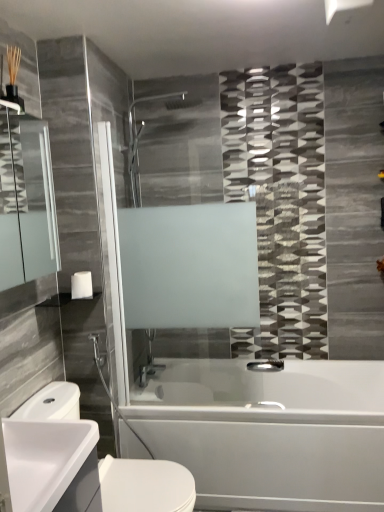
Question: Considering the relative sizes of white glossy bathtub at lower center and white glossy towel bar at upper left in the image provided, is white glossy bathtub at lower center thinner than white glossy towel bar at upper left?

Choices:
 (A) no
 (B) yes

Answer: (A)

Question: From the image's perspective, is white glossy bathtub at lower center located above white glossy towel bar at upper left?

Choices:
 (A) yes
 (B) no

Answer: (B)

Question: Is there a large distance between white glossy bathtub at lower center and white glossy towel bar at upper left?

Choices:
 (A) yes
 (B) no

Answer: (A)

Question: Does white glossy bathtub at lower center appear on the left side of white glossy towel bar at upper left?

Choices:
 (A) yes
 (B) no

Answer: (B)

Question: Is white glossy bathtub at lower center next to white glossy towel bar at upper left and touching it?

Choices:
 (A) yes
 (B) no

Answer: (B)

Question: From the image's perspective, is white matte toilet paper at lower left above or below white glossy sink at lower left?

Choices:
 (A) above
 (B) below

Answer: (A)

Question: Based on their positions, is white matte toilet paper at lower left located to the left or right of white glossy sink at lower left?

Choices:
 (A) right
 (B) left

Answer: (B)

Question: Is white matte toilet paper at lower left wider or thinner than white glossy sink at lower left?

Choices:
 (A) wide
 (B) thin

Answer: (B)

Question: Considering their positions, is white matte toilet paper at lower left located in front of or behind white glossy sink at lower left?

Choices:
 (A) front
 (B) behind

Answer: (B)

Question: From their relative heights in the image, would you say polished chrome faucet at lower center is taller or shorter than white matte toilet paper at lower left?

Choices:
 (A) short
 (B) tall

Answer: (A)

Question: Is polished chrome faucet at lower center in front of or behind white matte toilet paper at lower left in the image?

Choices:
 (A) front
 (B) behind

Answer: (B)

Question: From a real-world perspective, relative to white matte toilet paper at lower left, is polished chrome faucet at lower center vertically above or below?

Choices:
 (A) below
 (B) above

Answer: (A)

Question: Does point (261, 360) appear closer or farther from the camera than point (71, 285)?

Choices:
 (A) closer
 (B) farther

Answer: (B)

Question: From a real-world perspective, is white glossy sink at lower left physically located above or below matte glass mirror at left?

Choices:
 (A) below
 (B) above

Answer: (A)

Question: Is white glossy sink at lower left taller or shorter than matte glass mirror at left?

Choices:
 (A) short
 (B) tall

Answer: (B)